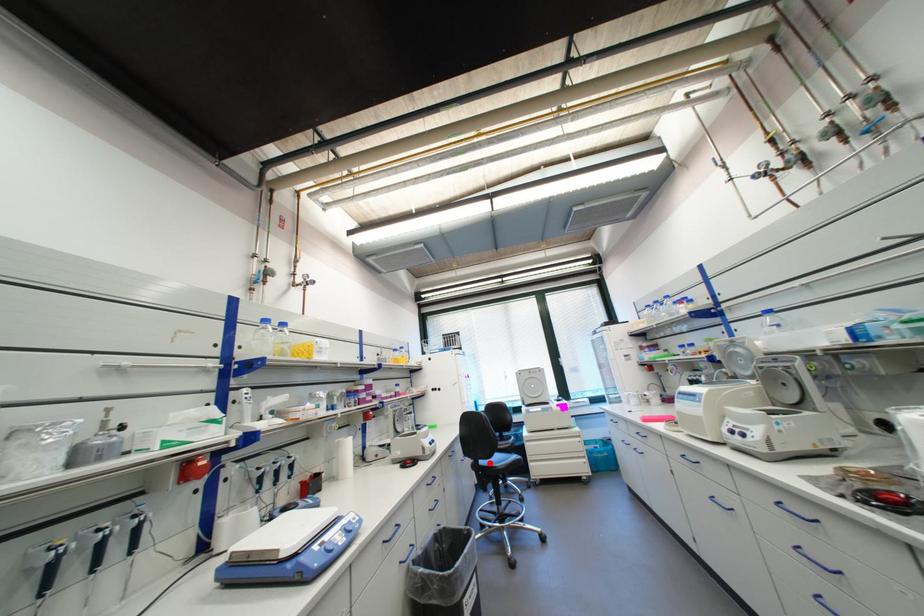
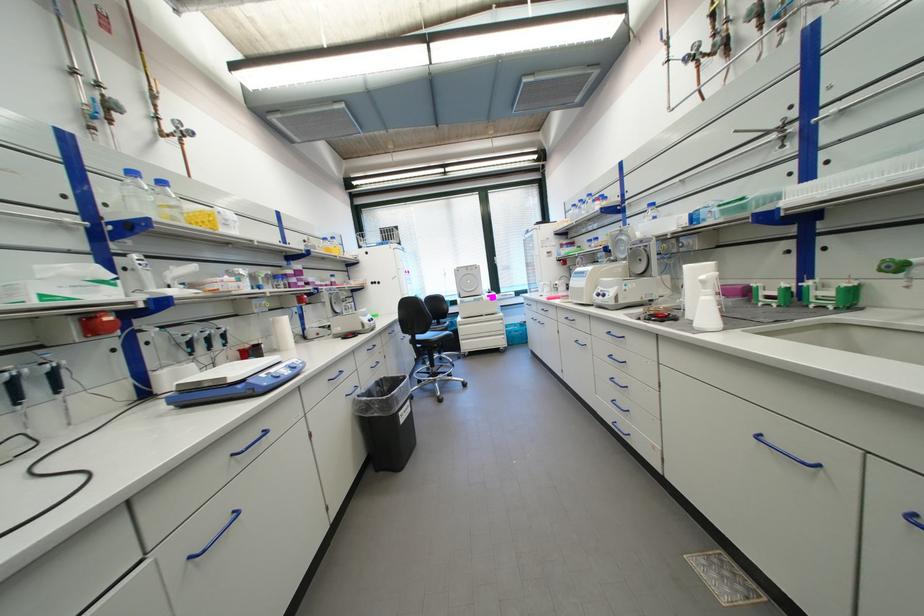
Where in the second image is the point corresponding to the highlighted location from the first image?

(427, 338)